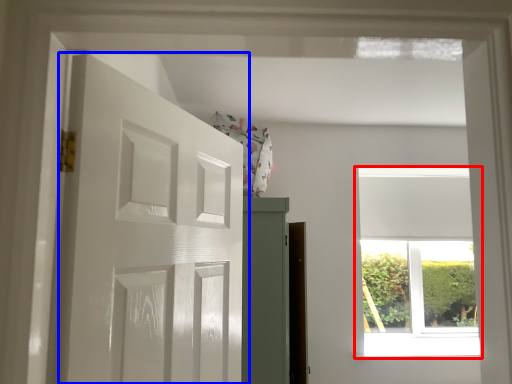
Question: Which object appears closest to the camera in this image, window (highlighted by a red box) or door (highlighted by a blue box)?

Choices:
 (A) window
 (B) door

Answer: (B)